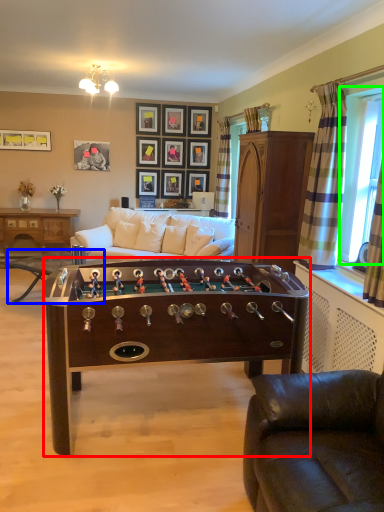
Question: Considering the real-world distances, which object is farthest from table (highlighted by a red box)? table (highlighted by a blue box) or window screen (highlighted by a green box)?

Choices:
 (A) table
 (B) window screen

Answer: (A)